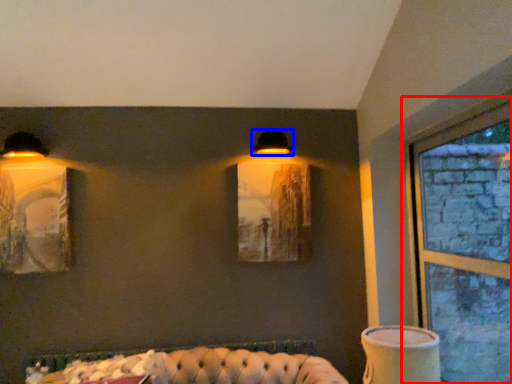
Question: Which object is closer to the camera taking this photo, window (highlighted by a red box) or lamp (highlighted by a blue box)?

Choices:
 (A) window
 (B) lamp

Answer: (A)